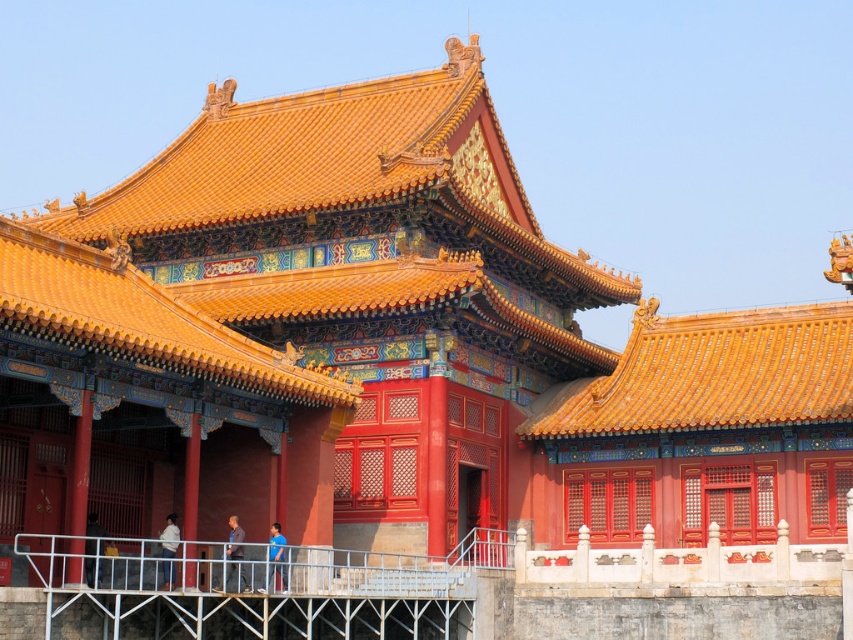
From the picture: You are standing on the viewing platform in front of the historical palace complex. There are two points marked on the railing in front of you. The first point is at coordinate point (86, 572), and the second point is at coordinate point (233, 524). Which point is closer to your current position?

Point (86, 572) is closer to the camera than point (233, 524), so the first point is closer to your current position.

You are standing at the viewing platform in front of the historical palace complex. You notice a blue fabric shirt at center and a white fabric at lower left. Which fabric is closer to you?

The blue fabric shirt at center is closer to you because the white fabric at lower left is behind it.

You are standing at the entrance of the historical palace complex and want to reach the viewing platform. According to the image, where is the metallic gray railing at lower center located? Please provide the coordinates in the format of point followed by the coordinates in parentheses.

The metallic gray railing at lower center is located at point (x=234, y=593).